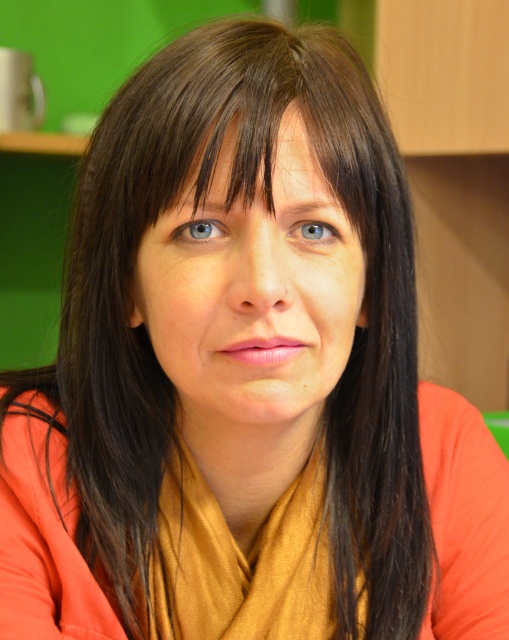
You are a photographer adjusting lighting for a portrait. You notice the smooth skin face at center and the blue glossy eye at center. Which object is located lower in the image?

The smooth skin face at center is positioned under the blue glossy eye at center, so the smooth skin face at center is lower in the image.

You are a photographer adjusting the focus of your camera. The subject has a smooth skin face at center and a blue glossy eye at upper center. To ensure both are in focus, what is the minimum depth of field required in inches?

The minimum depth of field required is at least 2.74 inches to ensure both the smooth skin face at center and the blue glossy eye at upper center are in focus.